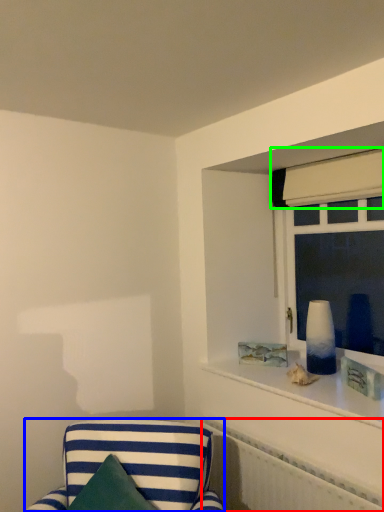
Question: Which object is positioned farthest from radiator (highlighted by a red box)? Select from furniture (highlighted by a blue box) and curtain (highlighted by a green box).

Choices:
 (A) furniture
 (B) curtain

Answer: (B)